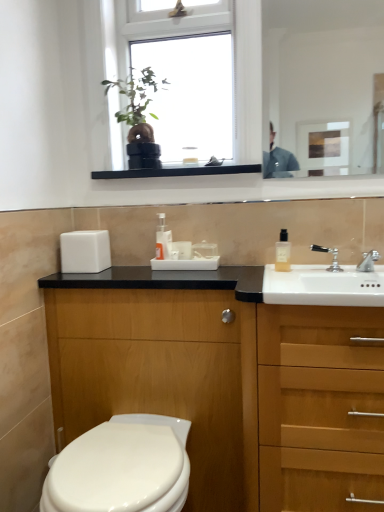
What do you see at coordinates (135, 94) in the screenshot? The width and height of the screenshot is (384, 512). I see `green matte plant at upper center` at bounding box center [135, 94].

The height and width of the screenshot is (512, 384). Describe the element at coordinates (283, 252) in the screenshot. I see `clear glass bottle at upper right, the 2th toiletry from the left` at that location.

Locate an element on the screen. The height and width of the screenshot is (512, 384). silver metallic faucet at sink right, placed as the 1th tap when sorted from left to right is located at coordinates (333, 257).

What is the approximate height of silver metallic faucet at right, the 1th tap viewed from the right?

It is 3.75 inches.

What do you see at coordinates (186, 82) in the screenshot?
I see `transparent glass window at upper center` at bounding box center [186, 82].

What are the coordinates of `wooden cabinet at lower left` in the screenshot? It's located at (228, 382).

Does transparent glass window at upper center have a lesser width compared to white glossy toilet at lower left?

Correct, the width of transparent glass window at upper center is less than that of white glossy toilet at lower left.

Does transparent glass window at upper center have a smaller size compared to white glossy toilet at lower left?

Yes.

Is transparent glass window at upper center taller or shorter than white glossy toilet at lower left?

transparent glass window at upper center is taller than white glossy toilet at lower left.

Is point (251, 78) closer or farther from the camera than point (117, 501)?

Point (251, 78).

From a real-world perspective, which is physically below, wooden cabinet at right or wooden drawer at right?

wooden cabinet at right is physically lower.

Is wooden cabinet at right at the left side of wooden drawer at right?

Yes.

Is point (271, 451) closer to viewer compared to point (372, 347)?

That is False.

Who is smaller, wooden cabinet at right or wooden drawer at right?

Smaller between the two is wooden drawer at right.

Is point (333, 66) farther from camera compared to point (314, 311)?

That is True.

Which object is further away from the camera, white glossy mirror at upper right or wooden cabinet at right?

white glossy mirror at upper right.

What's the angular difference between white glossy mirror at upper right and wooden cabinet at right's facing directions?

0.145 degrees.

Consider the image. From a real-world perspective, relative to clear glass bottle at upper right, the first toiletry when ordered from front to back, is green matte plant at upper center vertically above or below?

Clearly, from a real-world perspective, green matte plant at upper center is above clear glass bottle at upper right, the first toiletry when ordered from front to back.

Is green matte plant at upper center oriented towards clear glass bottle at upper right, the 2th toiletry from the left?

No, green matte plant at upper center is not facing towards clear glass bottle at upper right, the 2th toiletry from the left.

Is green matte plant at upper center situated inside clear glass bottle at upper right, the first toiletry when ordered from front to back, or outside?

green matte plant at upper center cannot be found inside clear glass bottle at upper right, the first toiletry when ordered from front to back.

From the image's perspective, is translucent plastic soap dispenser at center, which appears as the first toiletry when viewed from the left, above or below white glossy mirror at upper right?

From the image's perspective, translucent plastic soap dispenser at center, which appears as the first toiletry when viewed from the left, appears below white glossy mirror at upper right.

From the picture: In the image, is translucent plastic soap dispenser at center, the second toiletry positioned from the right, on the left side or the right side of white glossy mirror at upper right?

In the image, translucent plastic soap dispenser at center, the second toiletry positioned from the right, appears on the left side of white glossy mirror at upper right.

Identify the location of mirror that is on the right side of translucent plastic soap dispenser at center, the second toiletry positioned from the right. (323, 66).

Based on the photo, is white glossy mirror at upper right positioned with its back to white glossy toilet at lower left?

That's not correct — white glossy mirror at upper right is not looking away from white glossy toilet at lower left.

Are white glossy mirror at upper right and white glossy toilet at lower left making contact?

No, white glossy mirror at upper right is not beside white glossy toilet at lower left.

Based on their positions, is white glossy mirror at upper right located to the left or right of white glossy toilet at lower left?

Clearly, white glossy mirror at upper right is on the right of white glossy toilet at lower left in the image.

Considering the positions of points (284, 250) and (153, 50), is point (284, 250) farther from camera compared to point (153, 50)?

No, it is not.

Find the location of a particular element. The width and height of the screenshot is (384, 512). the 1st toiletry behind the transparent glass window at upper center is located at coordinates (283, 252).

From the picture: Is clear glass bottle at upper right, the second toiletry viewed from the back, not near transparent glass window at upper center?

No.

I want to click on toilet on the left of transparent glass window at upper center, so click(x=122, y=467).

I want to click on drawer above the wooden cabinet at right (from a real-world perspective), so click(x=319, y=336).

Looking at the image, which one is located further to silver metallic faucet at right, marked as the 2th tap in a left-to-right arrangement, white glossy toilet at lower left or silver metallic faucet at sink right, which is the second tap in right-to-left order?

The object further to silver metallic faucet at right, marked as the 2th tap in a left-to-right arrangement, is white glossy toilet at lower left.

From the image, which object appears to be nearer to clear glass bottle at upper right, the 2th toiletry from the left, green matte plant at upper center or white glossy toilet at lower left?

The object closer to clear glass bottle at upper right, the 2th toiletry from the left, is green matte plant at upper center.

When comparing their distances from translucent plastic soap dispenser at center, marked as the first toiletry in a back-to-front arrangement, does green matte plant at upper center or wooden cabinet at lower left seem closer?

green matte plant at upper center is positioned closer to the anchor translucent plastic soap dispenser at center, marked as the first toiletry in a back-to-front arrangement.

Considering their positions, is white glossy mirror at upper right positioned closer to wooden cabinet at right than wooden drawer at right?

wooden drawer at right.

Which object lies nearer to the anchor point silver metallic faucet at sink right, placed as the 1th tap when sorted from left to right, green matte plant at upper center or white glossy mirror at upper right?

Among the two, green matte plant at upper center is located nearer to silver metallic faucet at sink right, placed as the 1th tap when sorted from left to right.

Based on their spatial positions, is white glossy toilet at lower left or wooden cabinet at right further from transparent glass window at upper center?

The object further to transparent glass window at upper center is white glossy toilet at lower left.

Which object lies nearer to the anchor point green matte plant at upper center, wooden drawer at right or transparent glass window at upper center?

transparent glass window at upper center is closer to green matte plant at upper center.

When comparing their distances from translucent plastic soap dispenser at center, marked as the first toiletry in a back-to-front arrangement, does silver metallic faucet at right, marked as the 2th tap in a left-to-right arrangement, or wooden cabinet at right seem further?

wooden cabinet at right lies further to translucent plastic soap dispenser at center, marked as the first toiletry in a back-to-front arrangement, than the other object.

Find the location of a particular element. Image resolution: width=384 pixels, height=512 pixels. drawer between transparent glass window at upper center and wooden cabinet at lower left in the up-down direction is located at coordinates (319, 336).

Locate an element on the screen. cabinetry that lies between clear glass bottle at upper right, the 2th toiletry from the left, and white glossy toilet at lower left from top to bottom is located at coordinates (320, 408).

Locate an element on the screen. The image size is (384, 512). mirror between green matte plant at upper center and silver metallic faucet at sink right, which is the second tap in right-to-left order, in the horizontal direction is located at coordinates (323, 66).

Find the location of a particular element. drawer located between white glossy toilet at lower left and silver metallic faucet at right, marked as the 2th tap in a left-to-right arrangement, in the left-right direction is located at coordinates (319, 336).